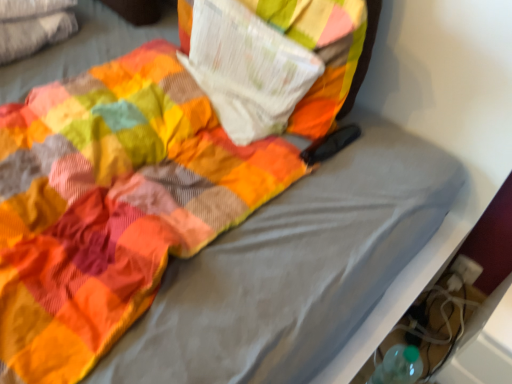
Question: In the image, is leather brown shoe at lower right on the left side or the right side of white paper at upper center?

Choices:
 (A) right
 (B) left

Answer: (A)

Question: In the image, is leather brown shoe at lower right positioned in front of or behind white paper at upper center?

Choices:
 (A) behind
 (B) front

Answer: (A)

Question: Is leather brown shoe at lower right bigger or smaller than white paper at upper center?

Choices:
 (A) small
 (B) big

Answer: (B)

Question: In the image, is white paper at upper center positioned in front of or behind leather brown shoe at lower right?

Choices:
 (A) behind
 (B) front

Answer: (B)

Question: Is white paper at upper center wider or thinner than leather brown shoe at lower right?

Choices:
 (A) thin
 (B) wide

Answer: (A)

Question: Is white paper at upper center situated inside leather brown shoe at lower right or outside?

Choices:
 (A) inside
 (B) outside

Answer: (B)

Question: From the image's perspective, is white paper at upper center positioned above or below leather brown shoe at lower right?

Choices:
 (A) below
 (B) above

Answer: (B)